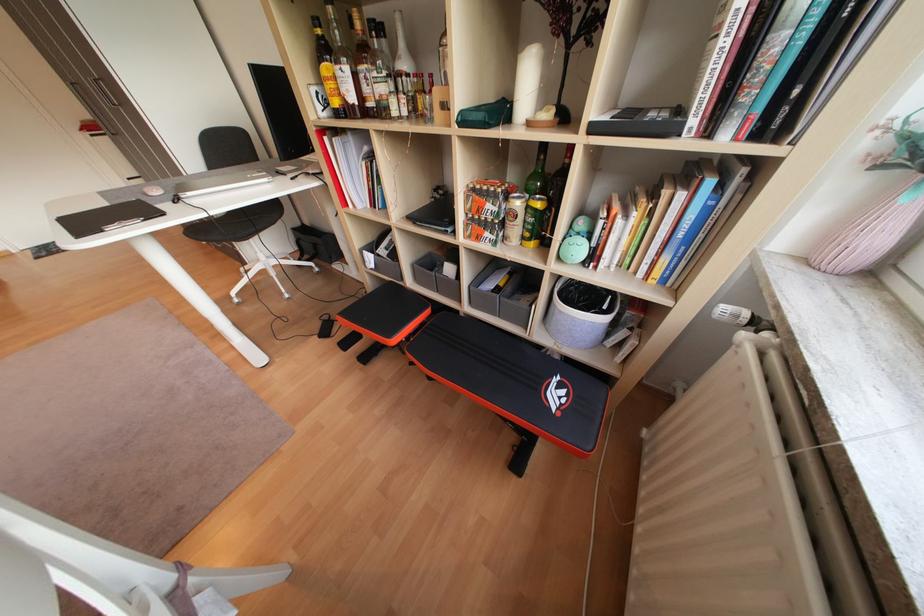
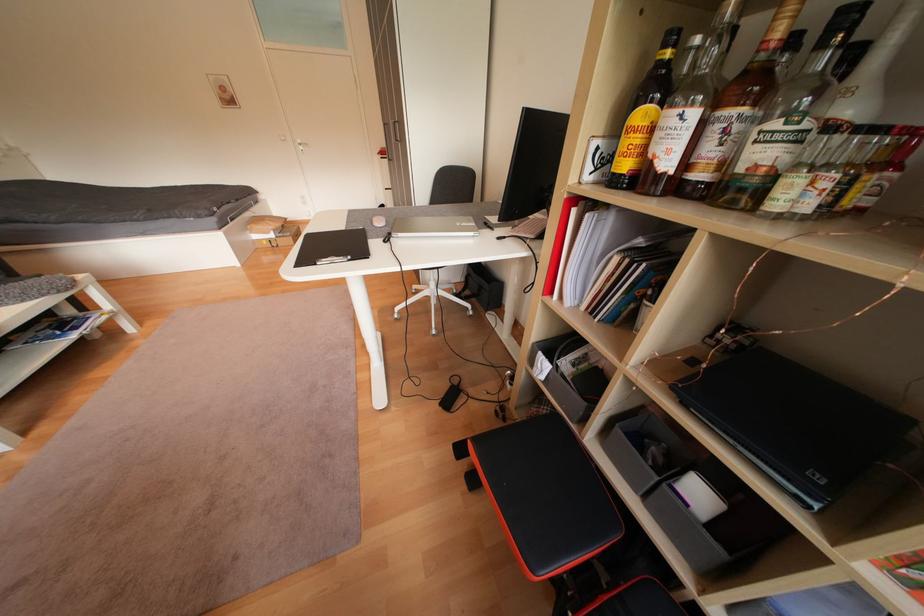
Question: The images are taken continuously from a first-person perspective. In which direction is your viewpoint rotating?

Choices:
 (A) Left
 (B) Right
 (C) Up
 (D) Down

Answer: (A)